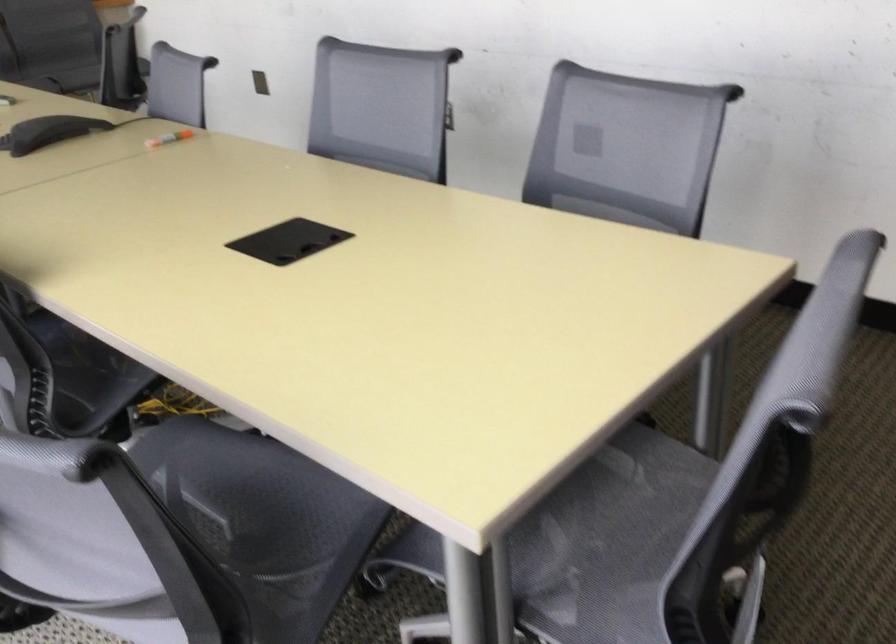
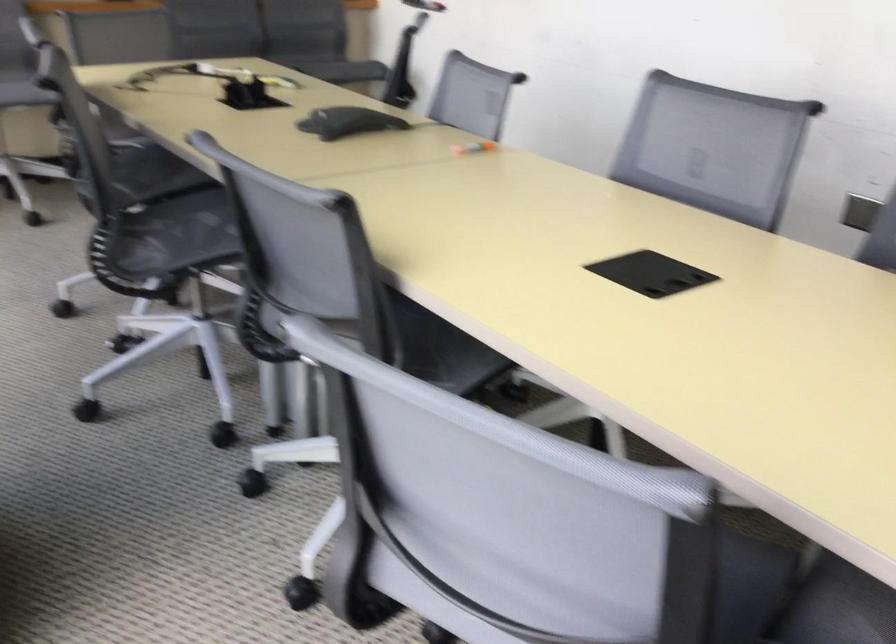
Question: Based on the continuous images, in which direction is the camera rotating? Reply with the corresponding letter.

Choices:
 (A) Left
 (B) Right
 (C) Up
 (D) Down

Answer: (A)